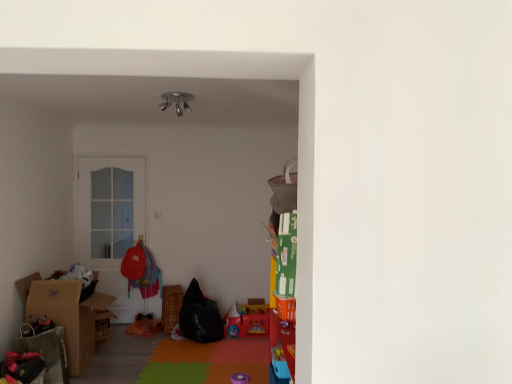
Question: Considering the relative positions of matte plastic toy at center and metallic chrome lamp at upper center in the image provided, is matte plastic toy at center to the left of metallic chrome lamp at upper center from the viewer's perspective?

Choices:
 (A) no
 (B) yes

Answer: (A)

Question: Is matte plastic toy at center surrounding metallic chrome lamp at upper center?

Choices:
 (A) no
 (B) yes

Answer: (A)

Question: Does matte plastic toy at center have a lesser height compared to metallic chrome lamp at upper center?

Choices:
 (A) yes
 (B) no

Answer: (B)

Question: Considering the relative sizes of matte plastic toy at center and metallic chrome lamp at upper center in the image provided, is matte plastic toy at center wider than metallic chrome lamp at upper center?

Choices:
 (A) no
 (B) yes

Answer: (B)

Question: Is metallic chrome lamp at upper center at the back of matte plastic toy at center?

Choices:
 (A) no
 (B) yes

Answer: (A)

Question: Does point (74, 355) appear closer or farther from the camera than point (290, 160)?

Choices:
 (A) farther
 (B) closer

Answer: (B)

Question: Is brown cardboard box at left bigger or smaller than gray fabric bean bag chair at upper right, arranged as the 1th bean bag chair when viewed from the right?

Choices:
 (A) small
 (B) big

Answer: (B)

Question: Considering the positions of brown cardboard box at left and gray fabric bean bag chair at upper right, which is counted as the 2th bean bag chair, starting from the left, in the image, is brown cardboard box at left taller or shorter than gray fabric bean bag chair at upper right, which is counted as the 2th bean bag chair, starting from the left,?

Choices:
 (A) short
 (B) tall

Answer: (B)

Question: From the image's perspective, is brown cardboard box at left located above or below gray fabric bean bag chair at upper right, positioned as the 2th bean bag chair in bottom-to-top order?

Choices:
 (A) above
 (B) below

Answer: (B)

Question: From a real-world perspective, relative to matte red backpack at center, is woven brown picnic basket at center vertically above or below?

Choices:
 (A) below
 (B) above

Answer: (A)

Question: Is woven brown picnic basket at center situated inside matte red backpack at center or outside?

Choices:
 (A) outside
 (B) inside

Answer: (A)

Question: In the image, is woven brown picnic basket at center on the left side or the right side of matte red backpack at center?

Choices:
 (A) left
 (B) right

Answer: (B)

Question: Is point pos(181,299) positioned closer to the camera than point pos(152,284)?

Choices:
 (A) closer
 (B) farther

Answer: (A)

Question: From a real-world perspective, is black fabric bean bag at center, the 1th bean bag chair positioned from the back, physically located above or below brown cardboard box at left?

Choices:
 (A) below
 (B) above

Answer: (A)

Question: Based on their sizes in the image, would you say black fabric bean bag at center, which appears as the second bean bag chair when viewed from the front, is bigger or smaller than brown cardboard box at left?

Choices:
 (A) small
 (B) big

Answer: (A)